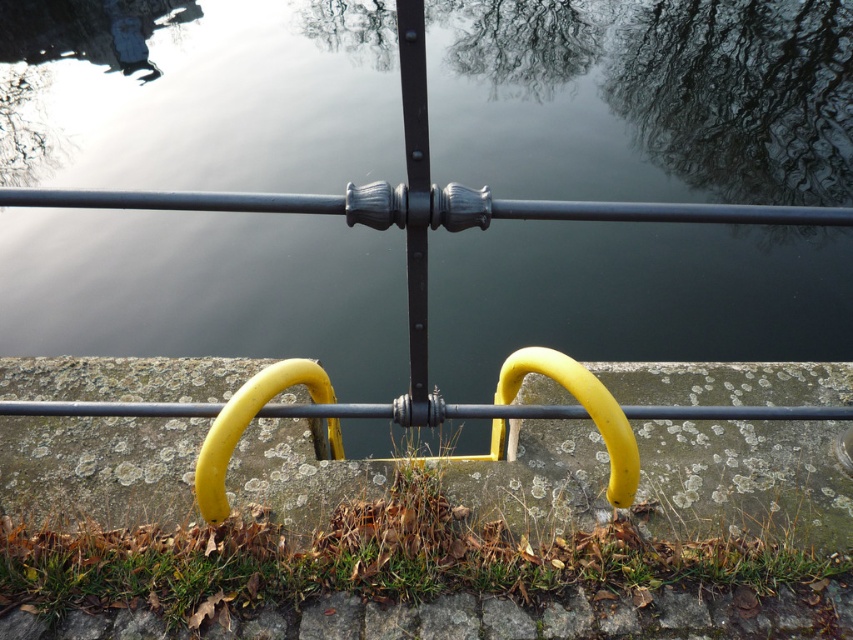
You are a delivery robot that is 20 feet wide. You need to move from the glossy dark water at center to the green grass at lower center. Can you fit through the space between them?

The glossy dark water at center and green grass at lower center are 19.46 feet apart from each other. Since the robot is 20 feet wide, it cannot fit through the space between them as the distance is narrower than the robot.

You are standing on the concrete ledge and want to pour water from a bucket into the glossy dark water at center and the green grass at lower center. Which object will the water reach first?

The glossy dark water at center will be reached first because it is much taller than the green grass at lower center, so pouring water from a bucket would naturally flow towards the lower elevation first.

Based on the photo, you are standing on the concrete ledge and want to step onto the green grass at lower center. Which direction should you move to reach it from the glossy dark water at center?

The glossy dark water at center is positioned on the left side of green grass at lower center, so you should move to the right to reach the green grass at lower center from the glossy dark water at center.